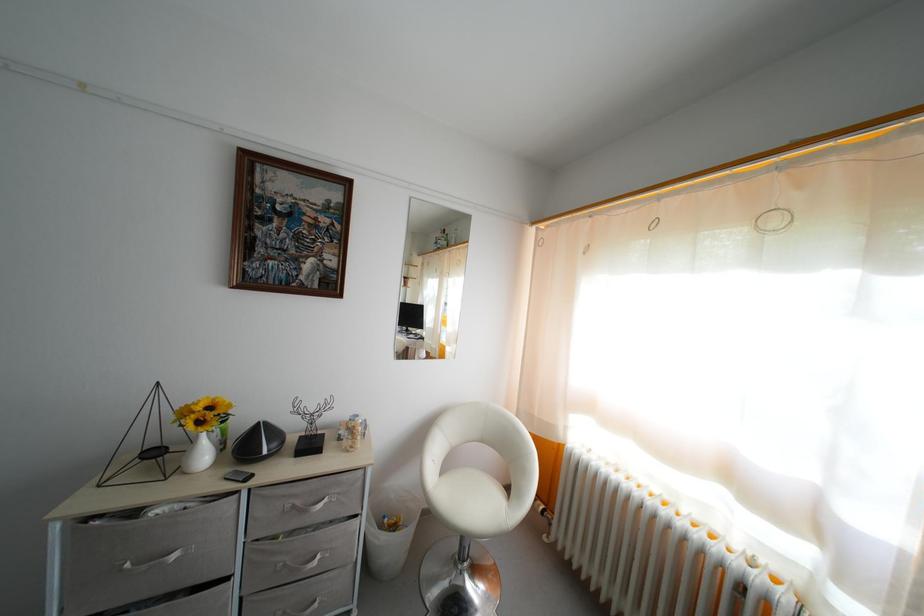
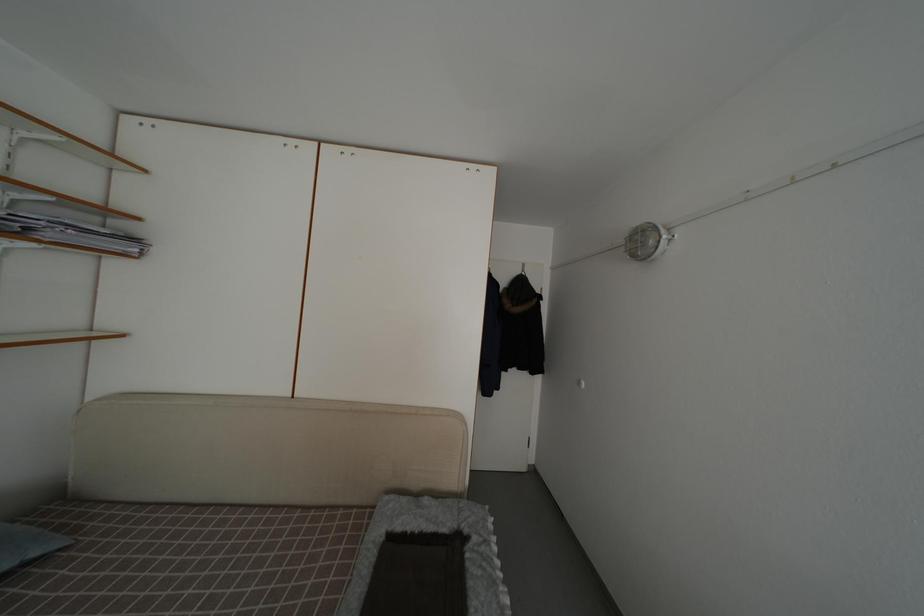
Question: The camera is either moving clockwise (left) or counter-clockwise (right) around the object. The first image is from the beginning of the video and the second image is from the end. Is the camera moving left or right when shooting the video?

Choices:
 (A) Left
 (B) Right

Answer: (B)